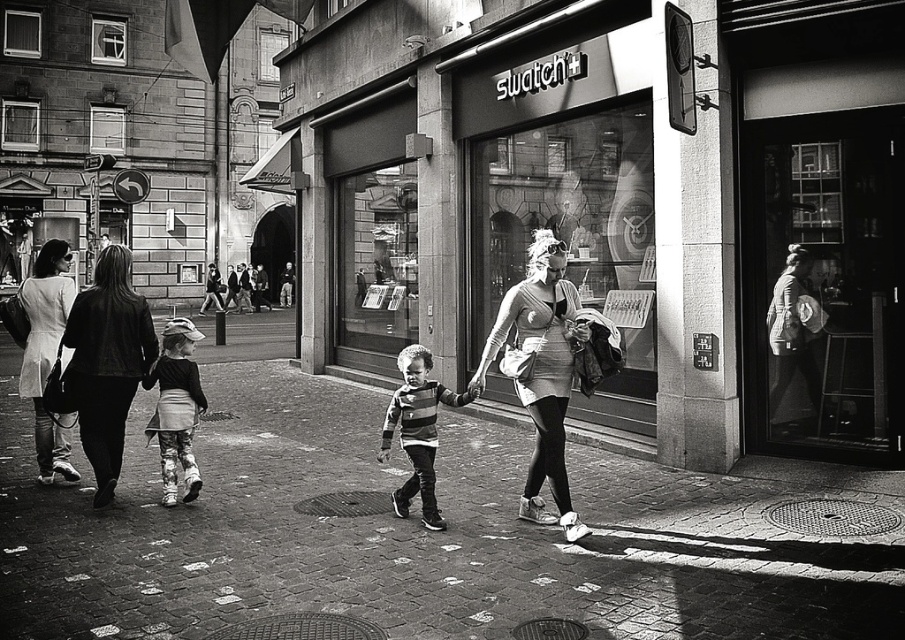
Question: Which point is farther from the camera taking this photo?

Choices:
 (A) (193, 486)
 (B) (46, 324)
 (C) (532, 237)

Answer: (C)

Question: Does black leather jacket at left have a smaller size compared to floral-patterned pants at left?

Choices:
 (A) yes
 (B) no

Answer: (B)

Question: Considering the relative positions of black leather jacket at left and striped fabric shirt at center in the image provided, where is black leather jacket at left located with respect to striped fabric shirt at center?

Choices:
 (A) right
 (B) left

Answer: (B)

Question: Estimate the real-world distances between objects in this image. Which object is farther from the black leather jacket at left?

Choices:
 (A) brick pavement at center
 (B) striped fabric shirt at center
 (C) floral-patterned pants at left
 (D) matte white coat at left

Answer: (B)

Question: Which object appears farthest from the camera in this image?

Choices:
 (A) striped fabric shirt at center
 (B) matte white dress at center
 (C) floral-patterned pants at left

Answer: (C)

Question: From the image, what is the correct spatial relationship of matte white dress at center in relation to matte white coat at left?

Choices:
 (A) below
 (B) above

Answer: (B)